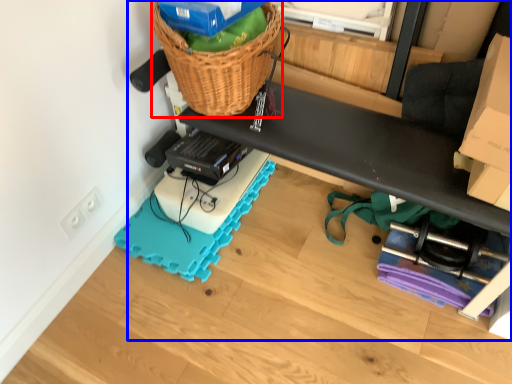
Question: Which object appears closest to the camera in this image, basket (highlighted by a red box) or furniture (highlighted by a blue box)?

Choices:
 (A) basket
 (B) furniture

Answer: (B)